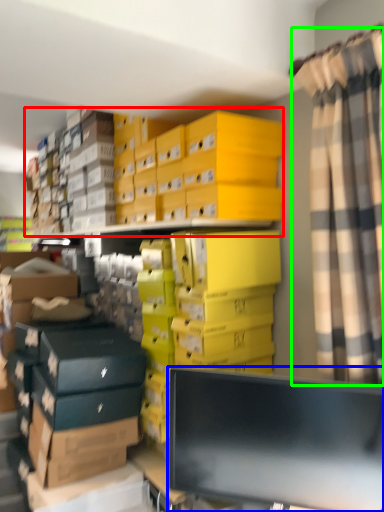
Question: Estimate the real-world distances between objects in this image. Which object is farther from storage box (highlighted by a red box), computer monitor (highlighted by a blue box) or curtain (highlighted by a green box)?

Choices:
 (A) computer monitor
 (B) curtain

Answer: (A)